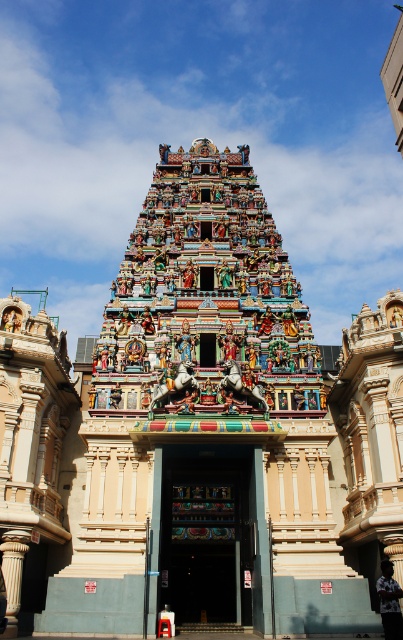
You are standing at the entrance of the temple and notice two points marked on the temple facade. The first point is located at coordinates point (295, 356) and the second at point (249, 604). Which of these points appears closer to your viewpoint?

Point (295, 356) is further to the camera than point (249, 604), so the point at (249, 604) is closer to your viewpoint.

You are standing in front of the temple entrance and need to locate the wooden carved door at center. According to the scene description, where should you look relative to the multicolored carved temple at center?

The wooden carved door at center is to the left of the multicolored carved temple at center, so you should look to the left side of the multicolored carved temple at center to find it.